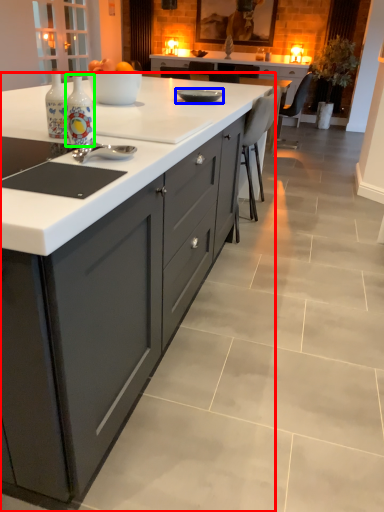
Question: Estimate the real-world distances between objects in this image. Which object is farther from cabinetry (highlighted by a red box), kitchen appliance (highlighted by a blue box) or bottle (highlighted by a green box)?

Choices:
 (A) kitchen appliance
 (B) bottle

Answer: (A)